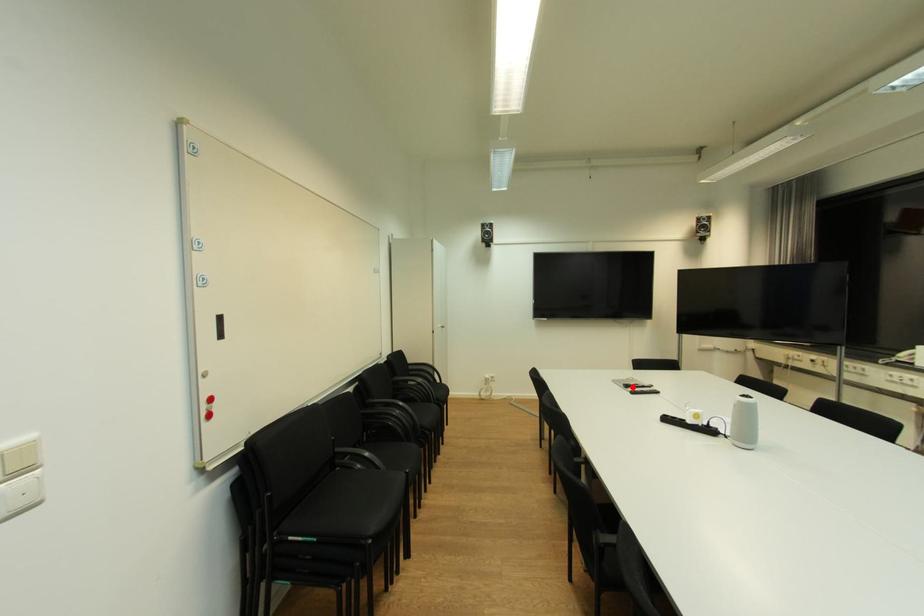
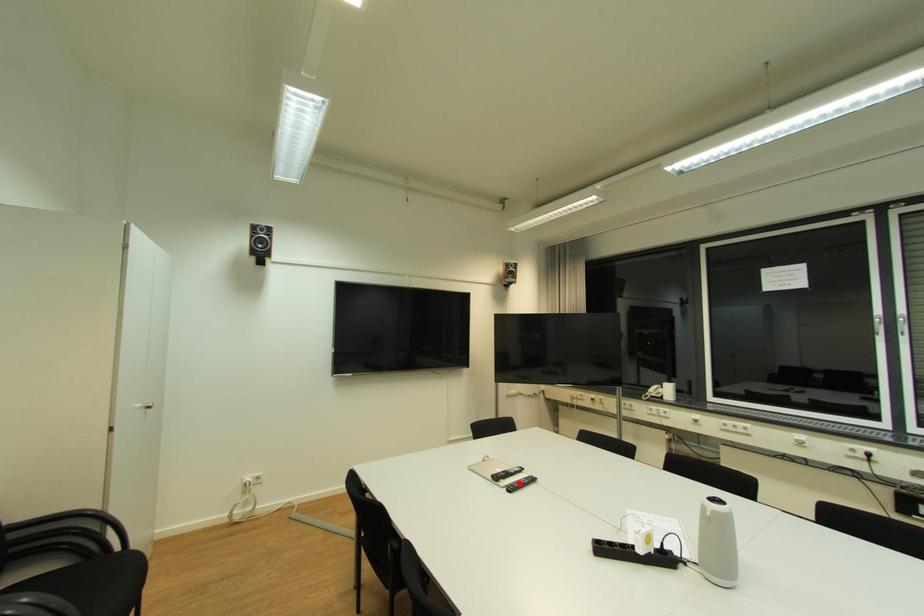
I am providing you with two images of the same scene from different viewpoints. A red point is marked on the first image and another point is marked on the second image. Does the point marked in image1 correspond to the same location as the one in image2?

No